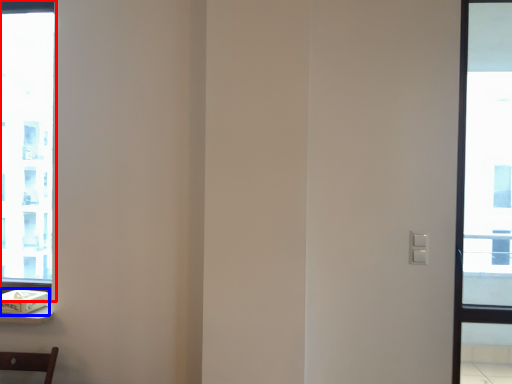
Question: Among these objects, which one is farthest to the camera, window (highlighted by a red box) or box (highlighted by a blue box)?

Choices:
 (A) window
 (B) box

Answer: (A)